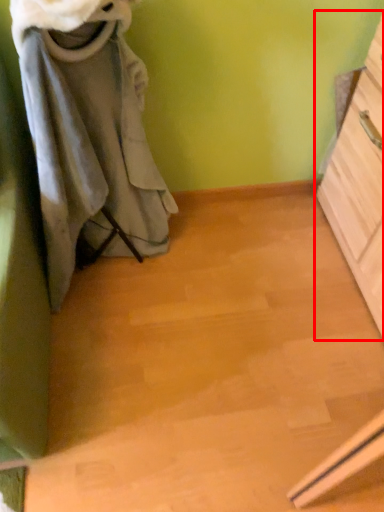
Question: From the image's perspective, what is the correct spatial relationship of chest of drawers (annotated by the red box) in relation to laundry?

Choices:
 (A) below
 (B) above

Answer: (A)